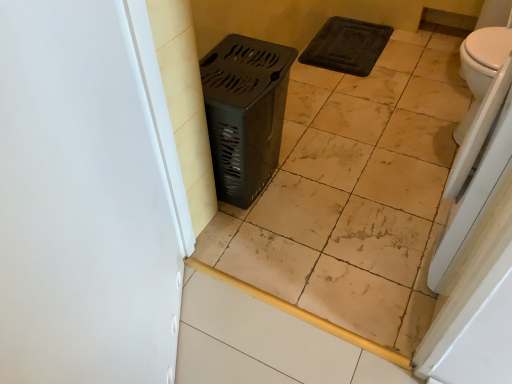
Question: From the image's perspective, relative to white glossy toilet at right, is metallic gray laundry basket at center above or below?

Choices:
 (A) above
 (B) below

Answer: (B)

Question: Considering the positions of point (221, 147) and point (464, 66), is point (221, 147) closer or farther from the camera than point (464, 66)?

Choices:
 (A) closer
 (B) farther

Answer: (A)

Question: Which object is the closest to the white matte screen door at left?

Choices:
 (A) metallic gray laundry basket at center
 (B) white glossy toilet at right
 (C) white glossy toilet at right
 (D) beige ceramic tile at center

Answer: (A)

Question: Which of these objects is positioned closest to the white glossy toilet at right?

Choices:
 (A) beige ceramic tile at center
 (B) white glossy toilet at right
 (C) metallic gray laundry basket at center
 (D) white matte screen door at left

Answer: (B)